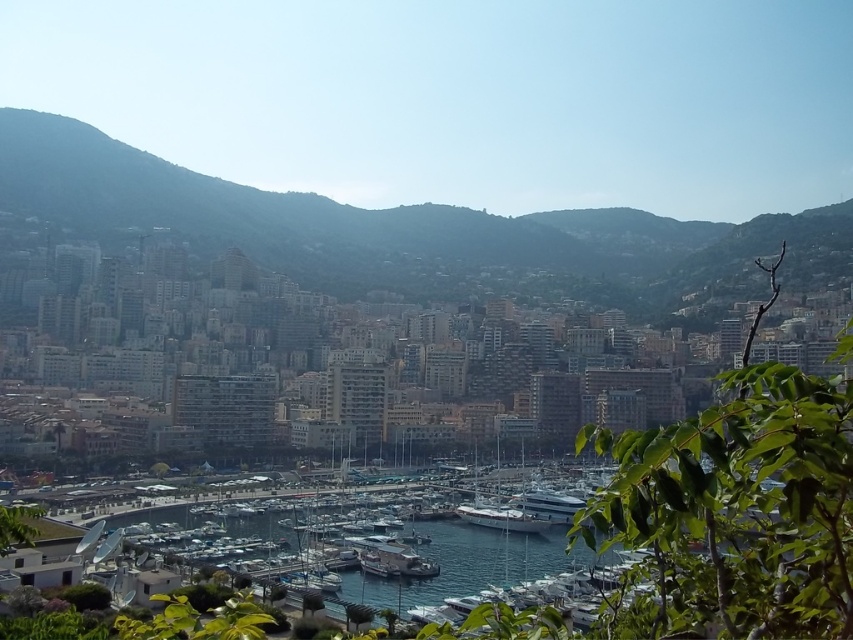
From the picture: You are a photographer planning to capture a shot of the green textured hillside at center and the clear blue water at lower center. Based on their positions, which object should you position on the left side of your camera frame?

The green textured hillside at center is to the left of clear blue water at lower center, so you should position the green textured hillside at center on the left side of your camera frame.